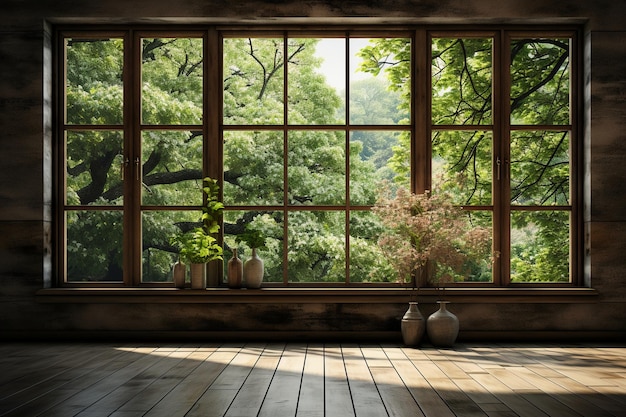
Where is `sections of window in bottom row`? The height and width of the screenshot is (417, 626). sections of window in bottom row is located at coordinates (85, 251), (160, 242), (254, 241), (310, 239), (372, 251), (461, 251), (545, 245).